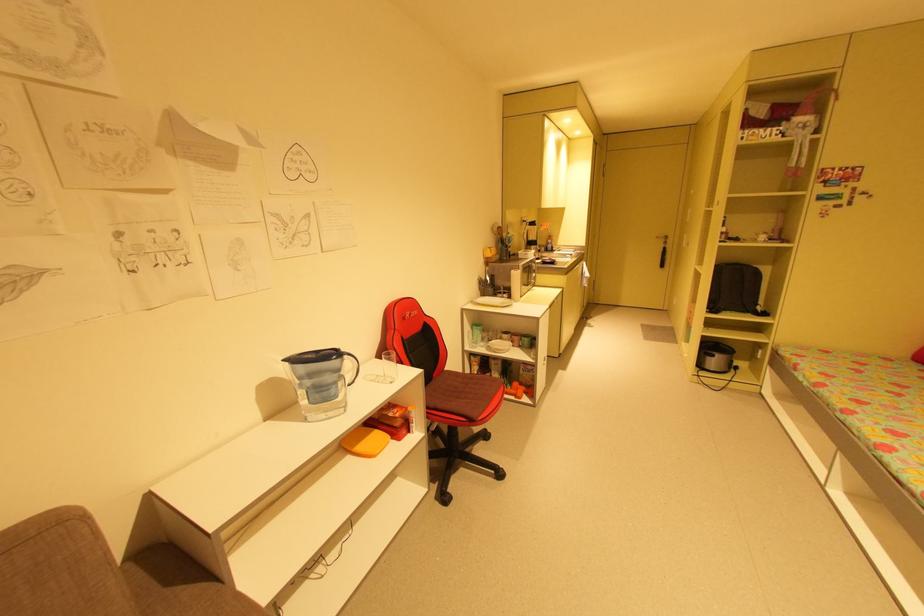
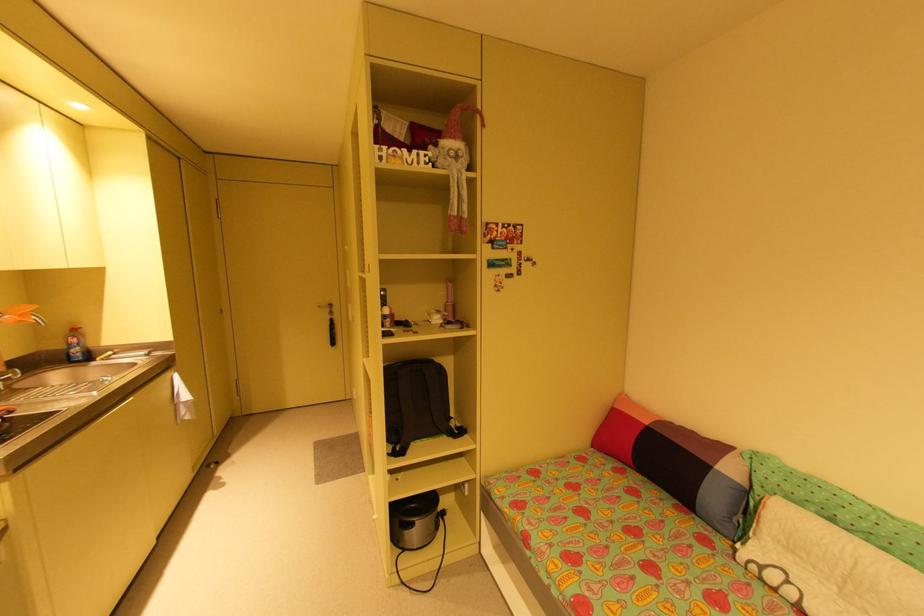
Find the pixel in the second image that matches [769,314] in the first image.

(466, 431)